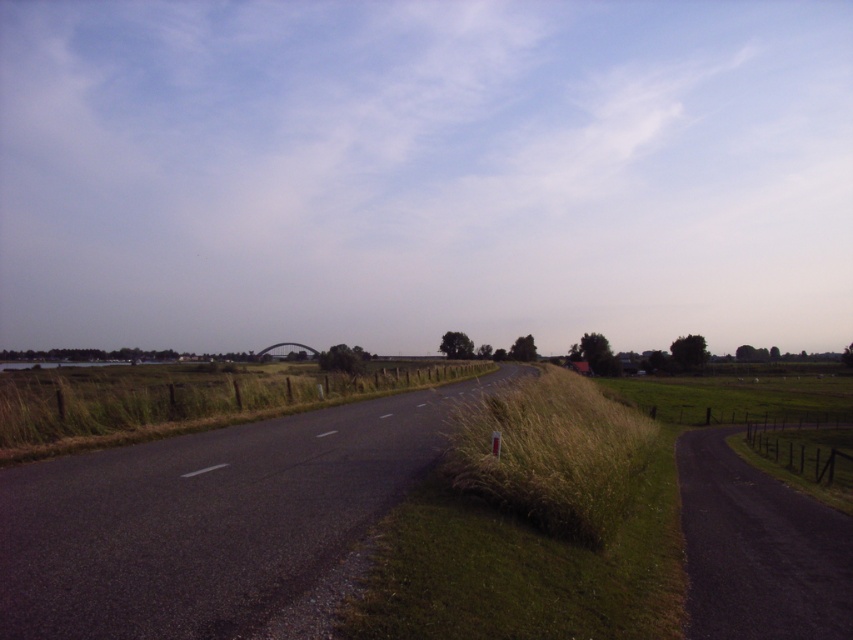
Question: Which object appears farthest from the camera in this image?

Choices:
 (A) green grassy at left
 (B) brown grassy patch at center
 (C) green grassy at center

Answer: (A)

Question: Does green grassy at center come behind green grassy at left?

Choices:
 (A) no
 (B) yes

Answer: (A)

Question: Does brown grassy patch at center appear on the left side of green grassy at left?

Choices:
 (A) yes
 (B) no

Answer: (B)

Question: Based on their relative distances, which object is nearer to the brown grassy patch at center?

Choices:
 (A) green grassy at center
 (B) green grassy at left

Answer: (A)

Question: Can you confirm if brown grassy patch at center is wider than green grassy at left?

Choices:
 (A) no
 (B) yes

Answer: (A)

Question: Which object is the closest to the brown grassy patch at center?

Choices:
 (A) green grassy at center
 (B) green grassy at left

Answer: (A)